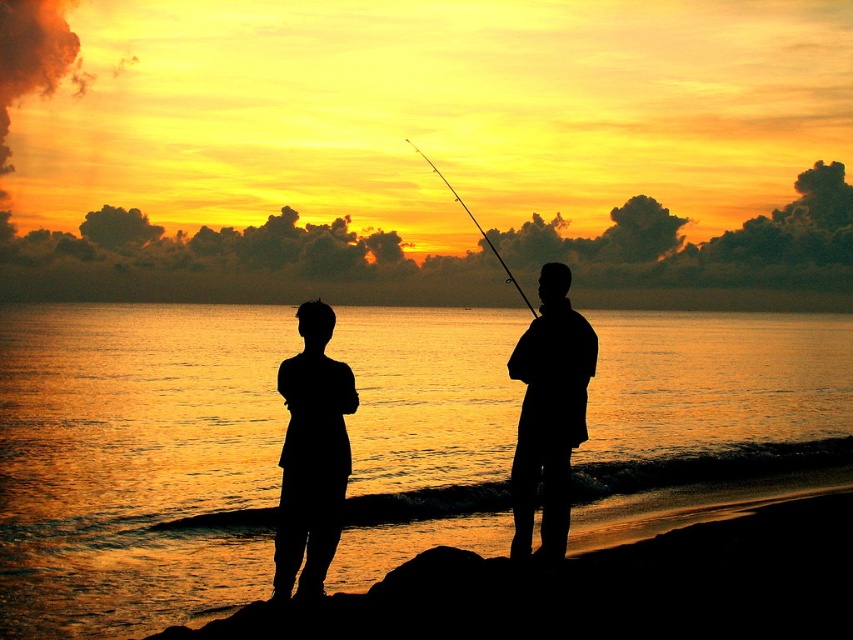
You are a photographer trying to capture the sunset with both the silhouette fishing rod at center and the smooth rod at center in your shot. Which rod will appear shorter in the photo?

The silhouette fishing rod at center will appear shorter in the photo since it has a lesser height compared to the smooth rod at center.

You are a photographer trying to capture the sunset with both the silhouette fishing rod at center and the smooth rod at center in your shot. Which rod will appear smaller in the photo?

The silhouette fishing rod at center will appear smaller in the photo because it is smaller than the smooth rod at center.